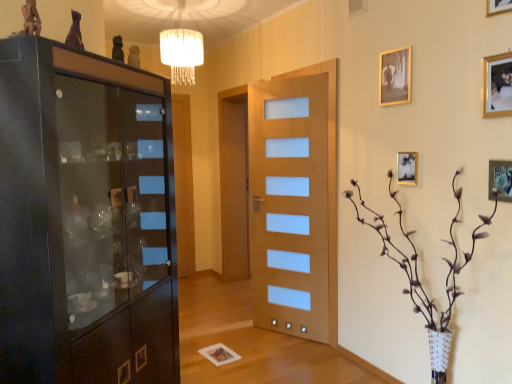
Question: Looking at their shapes, would you say wooden door with frosted glass panels at center is wider or thinner than gold metallic picture frame at upper right, which appears as the 3th picture frame when viewed from the top?

Choices:
 (A) wide
 (B) thin

Answer: (A)

Question: From the image's perspective, is wooden door with frosted glass panels at center located above or below gold metallic picture frame at upper right, which appears as the 3th picture frame when viewed from the top?

Choices:
 (A) above
 (B) below

Answer: (B)

Question: Based on their relative distances, which object is farther from the brown textured vase at right?

Choices:
 (A) white fabric lampshade at upper center
 (B) gold metallic picture frame at upper right, the 5th picture frame in the bottom-to-top sequence
 (C) wooden door with frosted glass panels at center
 (D) gold metallic picture frame at upper right, which appears as the 4th picture frame when viewed from the top
 (E) matte black statue at upper left, which is counted as the 2th art, starting from the back

Answer: (E)

Question: Which object is positioned farthest from the white fabric lampshade at upper center?

Choices:
 (A) matte black cabinet at left
 (B) wooden door with frosted glass panels at center
 (C) gold metallic picture frame at upper right, which appears as the 3th picture frame when viewed from the top
 (D) gold metallic picture frame at upper right, the 5th picture frame in the bottom-to-top sequence
 (E) matte black statue at upper left, which is the 1th art from left to right

Answer: (C)